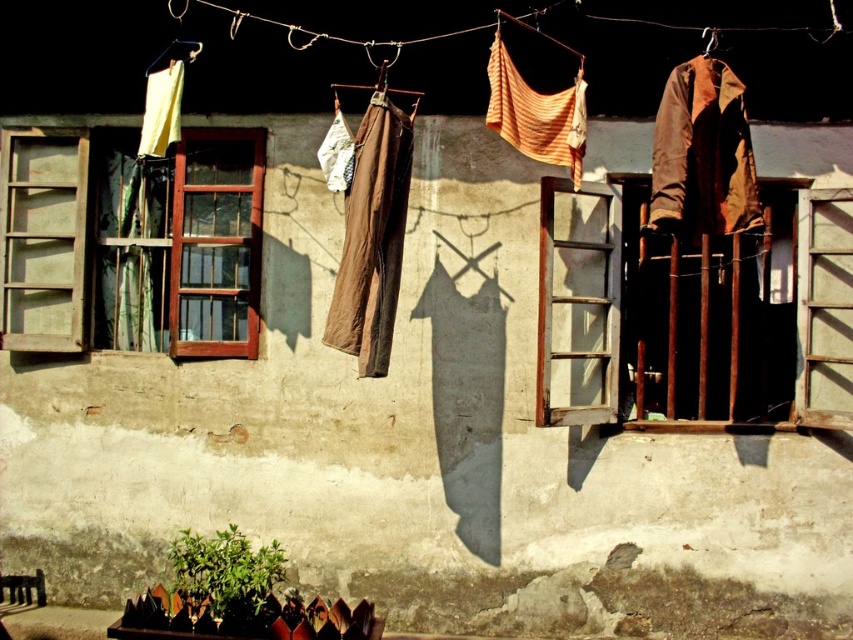
Is brown leather jacket at right to the right of brown cotton pants at center from the viewer's perspective?

Indeed, brown leather jacket at right is positioned on the right side of brown cotton pants at center.

Who is positioned more to the left, brown leather jacket at right or brown cotton pants at center?

brown cotton pants at center

Does point (733, 214) lie behind point (376, 273)?

No, it is not.

Locate an element on the screen. The width and height of the screenshot is (853, 640). brown leather jacket at right is located at coordinates (703, 154).

Is brown cotton pants at center in front of brown fabric at upper right?

Yes, it is.

From the picture: Between brown cotton pants at center and brown fabric at upper right, which one appears on the right side from the viewer's perspective?

From the viewer's perspective, brown fabric at upper right appears more on the right side.

The width and height of the screenshot is (853, 640). Identify the location of brown cotton pants at center. (372, 237).

Where is `brown cotton pants at center`? The width and height of the screenshot is (853, 640). brown cotton pants at center is located at coordinates (372, 237).

Who is positioned more to the left, brown leather jacket at right or striped cotton cloth at center?

striped cotton cloth at center

Which is behind, point (701, 202) or point (543, 109)?

Point (543, 109)

Where is `brown leather jacket at right`? brown leather jacket at right is located at coordinates [703, 154].